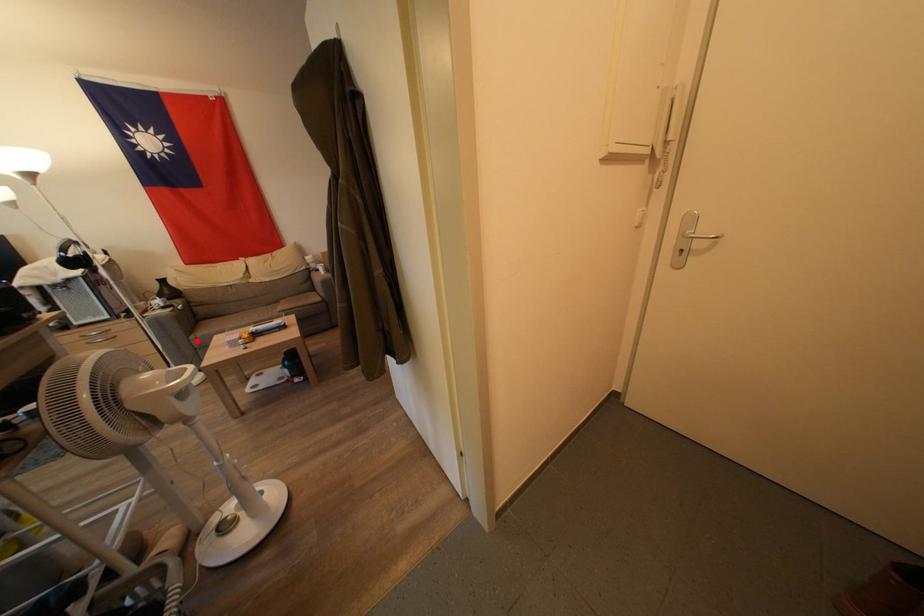
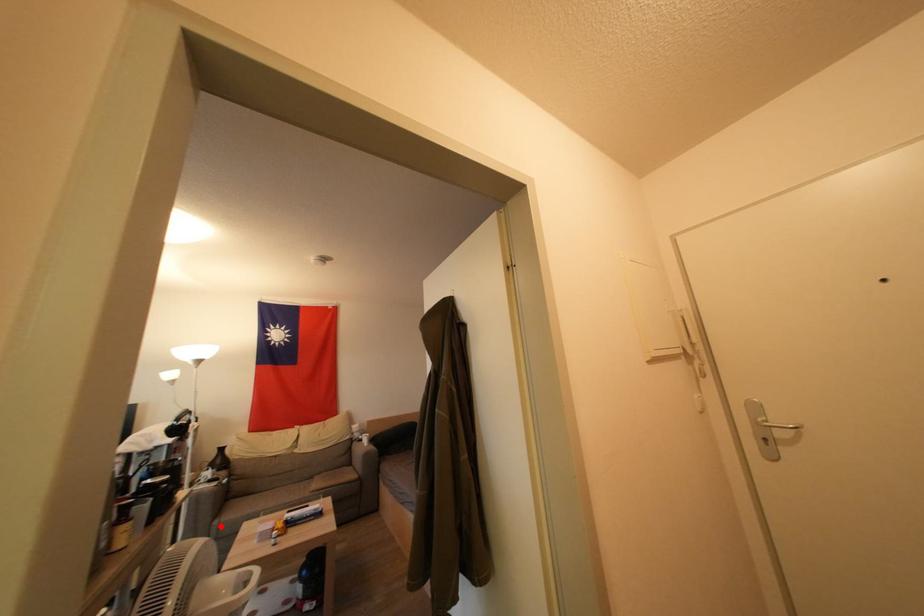
I am providing you with two images of the same scene from different viewpoints. A red point is marked on the first image and another point is marked on the second image. Do the highlighted points in image1 and image2 indicate the same real-world spot?

Yes